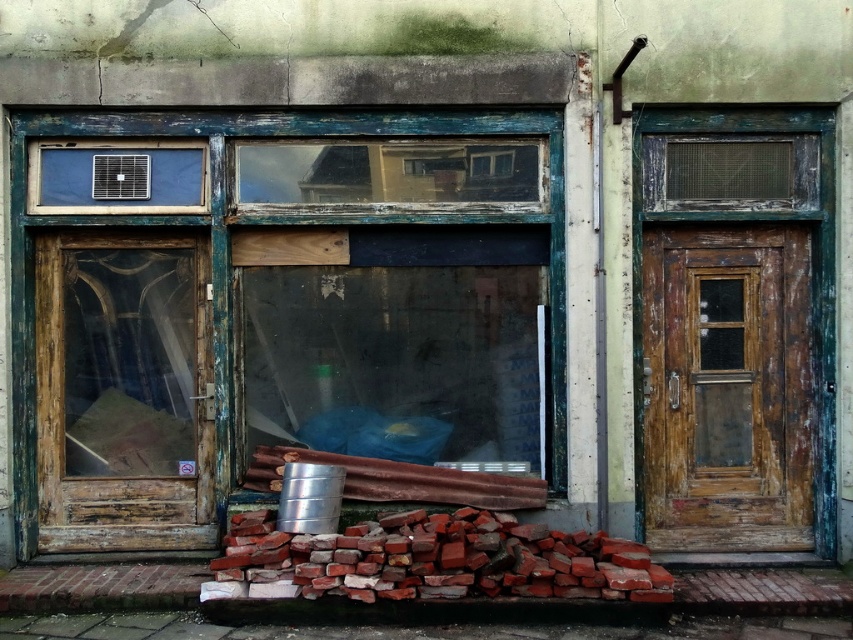
Question: Which of the following is the closest to the observer?

Choices:
 (A) weathered wood door at right
 (B) brick rubble at lower center
 (C) wooden door at left
 (D) wooden frame window at center

Answer: (B)

Question: Is weathered wood door at right in front of brick rubble at lower center?

Choices:
 (A) yes
 (B) no

Answer: (B)

Question: Which point is closer to the camera taking this photo?

Choices:
 (A) (523, 244)
 (B) (432, 525)

Answer: (B)

Question: Does wooden frame window at center have a lesser width compared to wooden door at left?

Choices:
 (A) yes
 (B) no

Answer: (B)

Question: Which point appears farthest from the camera in this image?

Choices:
 (A) (202, 337)
 (B) (503, 520)

Answer: (A)

Question: Is wooden frame window at center positioned at the back of brick rubble at lower center?

Choices:
 (A) yes
 (B) no

Answer: (A)